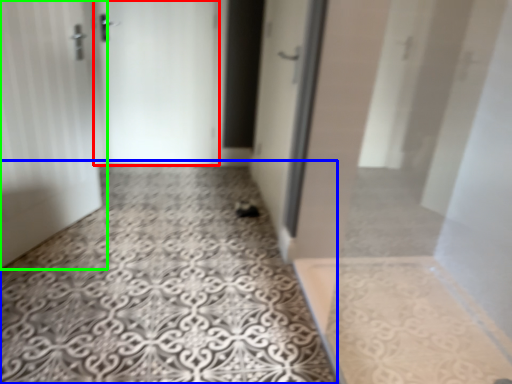
Question: Which object is positioned farthest from door (highlighted by a red box)? Select from concrete (highlighted by a blue box) and door (highlighted by a green box).

Choices:
 (A) concrete
 (B) door

Answer: (A)